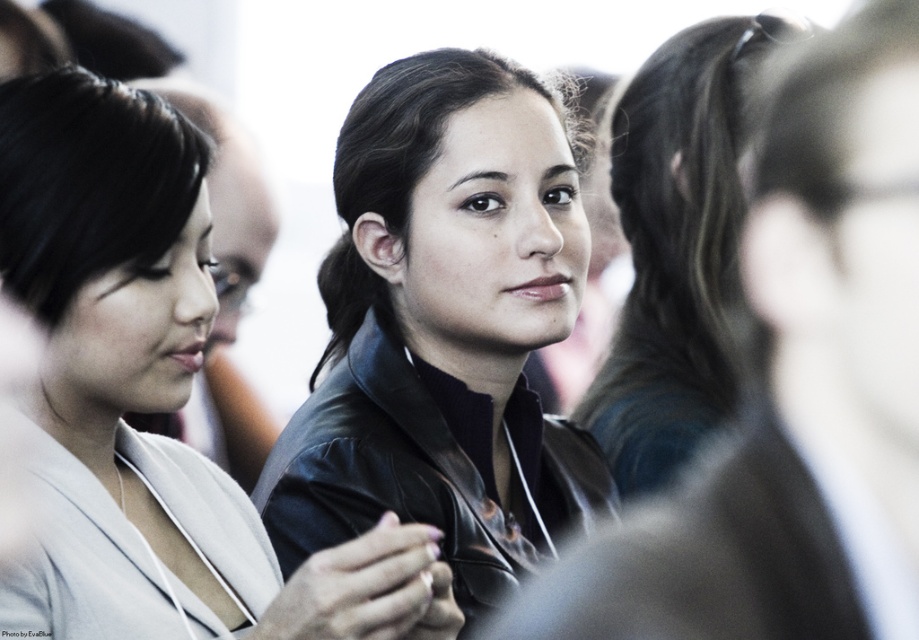
Question: Which object is closer to the camera taking this photo?

Choices:
 (A) black leather jacket at center
 (B) matte black jacket at center

Answer: (A)

Question: Does black leather jacket at center appear over dark brown hair at center?

Choices:
 (A) no
 (B) yes

Answer: (A)

Question: Does black leather jacket at center have a larger size compared to dark brown hair at center?

Choices:
 (A) yes
 (B) no

Answer: (B)

Question: Which is nearer to the matte black jacket at center?

Choices:
 (A) dark brown hair at center
 (B) black leather jacket at center

Answer: (B)

Question: In this image, where is matte black jacket at center located relative to dark brown hair at center?

Choices:
 (A) above
 (B) below

Answer: (B)

Question: Which of the following is the farthest from the observer?

Choices:
 (A) dark brown hair at center
 (B) matte black jacket at center
 (C) black leather jacket at center

Answer: (A)